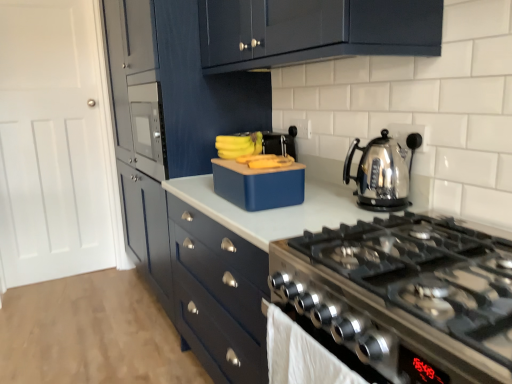
Question: Considering the relative sizes of light brown wood floor at lower left and blue matte lunchbox at center in the image provided, is light brown wood floor at lower left shorter than blue matte lunchbox at center?

Choices:
 (A) no
 (B) yes

Answer: (B)

Question: From the image's perspective, is light brown wood floor at lower left located above blue matte lunchbox at center?

Choices:
 (A) no
 (B) yes

Answer: (A)

Question: Would you say light brown wood floor at lower left is outside blue matte lunchbox at center?

Choices:
 (A) no
 (B) yes

Answer: (B)

Question: Is light brown wood floor at lower left thinner than blue matte lunchbox at center?

Choices:
 (A) yes
 (B) no

Answer: (B)

Question: Is light brown wood floor at lower left oriented away from blue matte lunchbox at center?

Choices:
 (A) no
 (B) yes

Answer: (A)

Question: Is light brown wood floor at lower left at the left side of blue matte lunchbox at center?

Choices:
 (A) yes
 (B) no

Answer: (A)

Question: From the image's perspective, does white glossy countertop at center appear higher than light brown wood floor at lower left?

Choices:
 (A) yes
 (B) no

Answer: (A)

Question: Is white glossy countertop at center bigger than light brown wood floor at lower left?

Choices:
 (A) no
 (B) yes

Answer: (B)

Question: Could you tell me if white glossy countertop at center is facing light brown wood floor at lower left?

Choices:
 (A) no
 (B) yes

Answer: (A)

Question: Is white glossy countertop at center taller than light brown wood floor at lower left?

Choices:
 (A) no
 (B) yes

Answer: (B)

Question: Is white glossy countertop at center with light brown wood floor at lower left?

Choices:
 (A) yes
 (B) no

Answer: (B)

Question: Does white glossy countertop at center appear on the right side of light brown wood floor at lower left?

Choices:
 (A) no
 (B) yes

Answer: (B)

Question: Is the position of stainless steel kettle at right less distant than that of matte blue cabinets at center, which is the first cabinetry in back-to-front order?

Choices:
 (A) no
 (B) yes

Answer: (B)